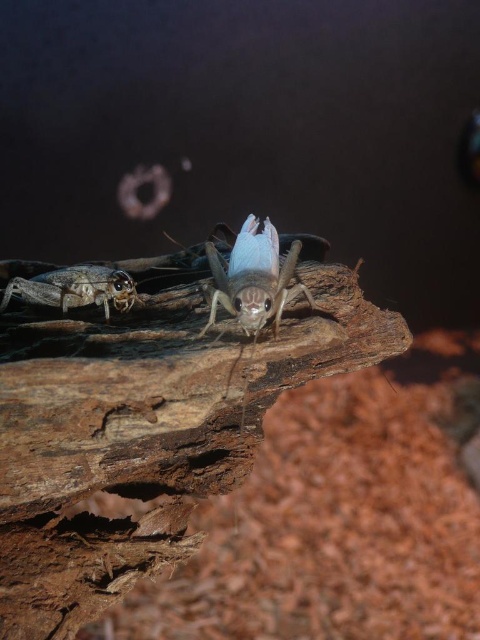
Who is taller, brown rough wood at center or translucent brown cricket at lower left?

brown rough wood at center is taller.

Who is more distant from viewer, (121,372) or (130,289)?

The point (130,289) is more distant.

What do you see at coordinates (145, 433) in the screenshot? The width and height of the screenshot is (480, 640). I see `brown rough wood at center` at bounding box center [145, 433].

Identify the location of brown rough wood at center. The height and width of the screenshot is (640, 480). (145, 433).

Can you confirm if brown rough wood at center is positioned to the right of translucent blue wings at center?

No, brown rough wood at center is not to the right of translucent blue wings at center.

Can you confirm if brown rough wood at center is positioned below translucent blue wings at center?

Yes.

Measure the distance between point (220, 492) and camera.

Point (220, 492) is 1.31 meters from camera.

The width and height of the screenshot is (480, 640). Find the location of `brown rough wood at center`. brown rough wood at center is located at coordinates (145, 433).

Is translucent blue wings at center thinner than translucent brown cricket at lower left?

Indeed, translucent blue wings at center has a lesser width compared to translucent brown cricket at lower left.

Looking at this image, does translucent blue wings at center appear on the left side of translucent brown cricket at lower left?

No, translucent blue wings at center is not to the left of translucent brown cricket at lower left.

This screenshot has width=480, height=640. I want to click on translucent blue wings at center, so click(x=253, y=276).